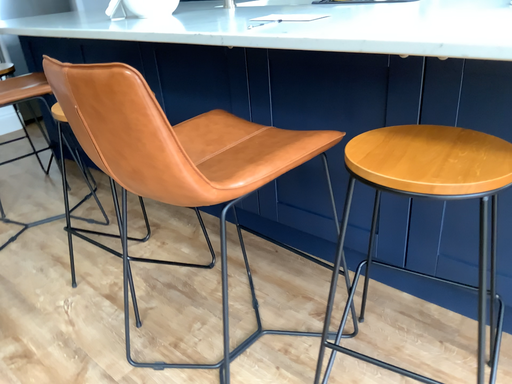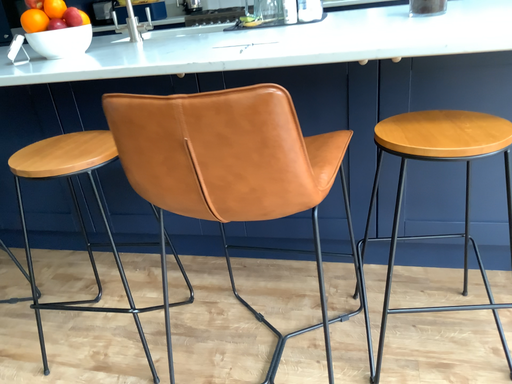
Question: Which way did the camera rotate in the video?

Choices:
 (A) rotated left
 (B) rotated right

Answer: (B)